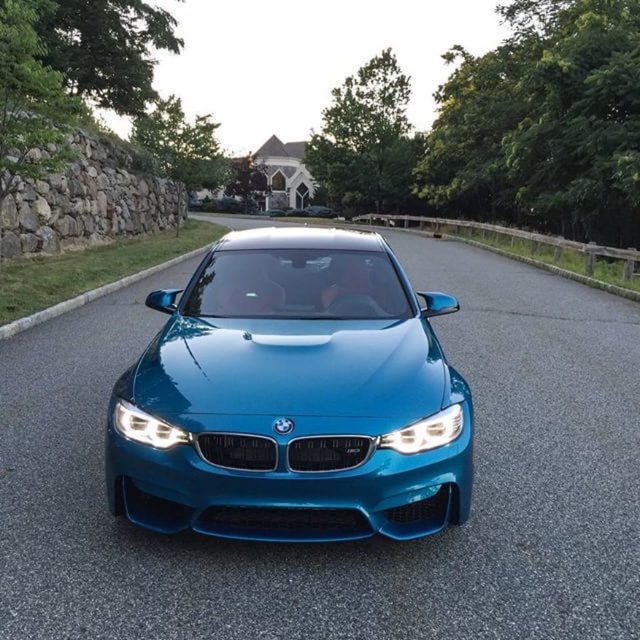
You are a car designer evaluating the BMW car in the scene. You notice two headlight options displayed as satin chrome headlight at center and matte blue headlight at center. Which headlight option has a greater width?

The satin chrome headlight at center has a greater width than the matte blue headlight at center according to the description.

You are a photographer trying to capture the glossy metallic car at center. You notice a point marked at coordinates [292,396]. Where is this point located relative to the car?

The point at coordinates [292,396] is located on the glossy metallic car at center, as indicated by the description.

You are a photographer trying to capture the glossy metallic car at center and the matte blue headlight at center in a single shot. Given that your camera can only focus on objects within a 2.5 meter width, will both objects fit in the frame?

The glossy metallic car at center is wider than the matte blue headlight at center. However, since both objects are part of the same car, their combined width may still fit within the camera frame. The camera can focus on objects within a 2.5 meter width, so if the total width of both objects together is less than or equal to 2.5 meters, they will fit. However, without knowing the exact combined width, it is impossible to determine definitively.